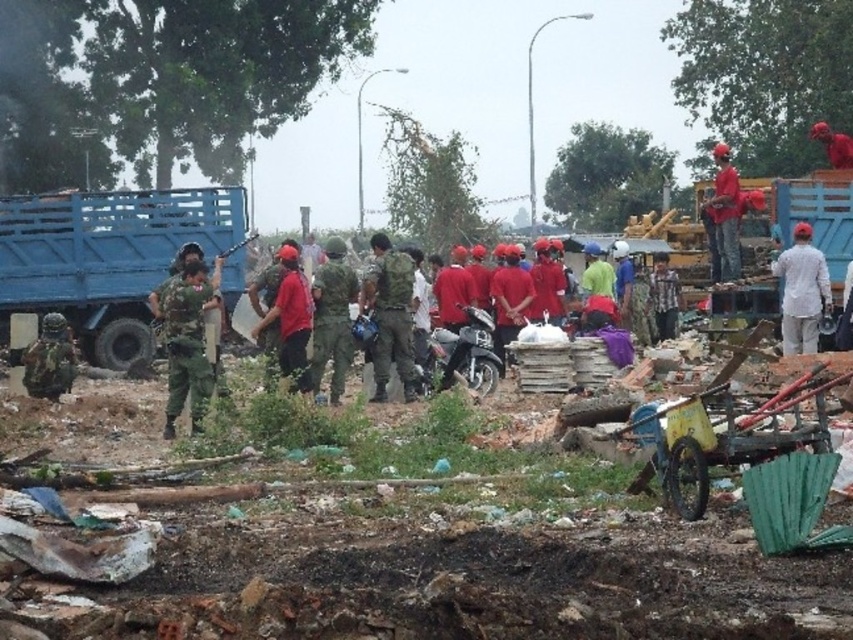
You are a delivery person who needs to park your vehicle next to the blue matte truck at left without blocking the camouflage fabric uniform at center. Is there enough space between them for your vehicle?

The blue matte truck at left is positioned on the left side of the camouflage fabric uniform at center, so there is space between them. You can park your vehicle between the blue matte truck at left and the camouflage fabric uniform at center without blocking the camouflage fabric uniform at center.

You are a delivery person who needs to park your 2.5 meters wide truck in the construction site. The parking space is between the blue matte truck at left and the camouflage fabric uniform at center. Can your truck fit in that space?

The blue matte truck at left might be wider than camouflage fabric uniform at center, so the parking space between them may not be wide enough for your 2.5 meters wide truck. You should check the exact width before attempting to park.

What is located at the coordinates point (111,259) in the image?

The blue matte truck at left is located at point (111,259).